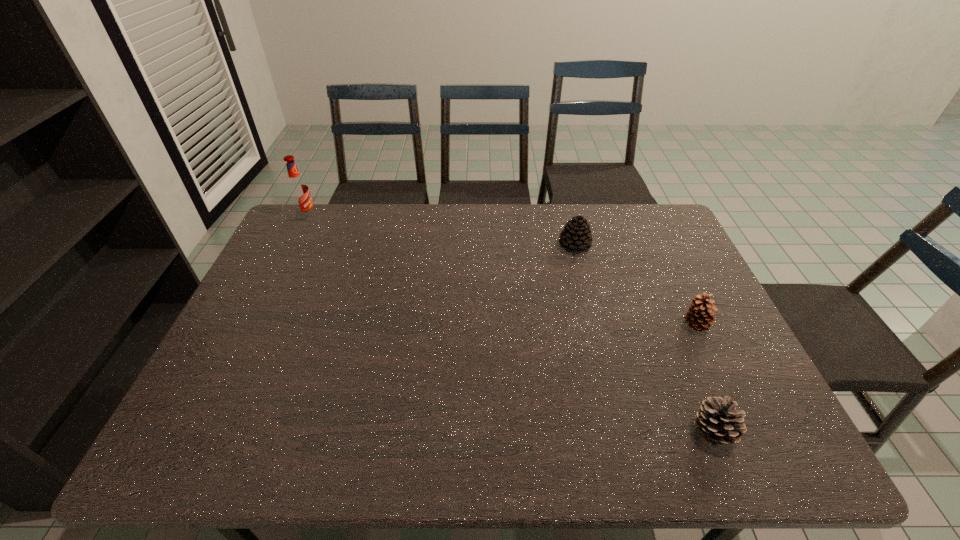
Identify the location of the tallest object. (298, 189).

At what (x,y) coordinates should I click in order to perform the action: click on the leftmost object. Please return your answer as a coordinate pair (x, y). The width and height of the screenshot is (960, 540). Looking at the image, I should click on (298, 189).

Image resolution: width=960 pixels, height=540 pixels. I want to click on the third object from right to left, so click(x=576, y=236).

Identify the location of the leftmost pinecone. (576, 236).

Image resolution: width=960 pixels, height=540 pixels. I want to click on the second farthest pinecone, so click(700, 316).

At what (x,y) coordinates should I click in order to perform the action: click on the nearest object. Please return your answer as a coordinate pair (x, y). Looking at the image, I should click on (717, 421).

Identify the location of free space located 0.140m on the right of the leftmost object. (356, 218).

At what (x,y) coordinates should I click in order to perform the action: click on free space located 0.350m at the narrow end of the leftmost pinecone. Please return your answer as a coordinate pair (x, y). Image resolution: width=960 pixels, height=540 pixels. Looking at the image, I should click on (599, 345).

Image resolution: width=960 pixels, height=540 pixels. I want to click on free space located 0.240m on the left of the second farthest pinecone, so click(592, 325).

Identify the location of blank space located 0.090m on the right of the nearest pinecone. (777, 431).